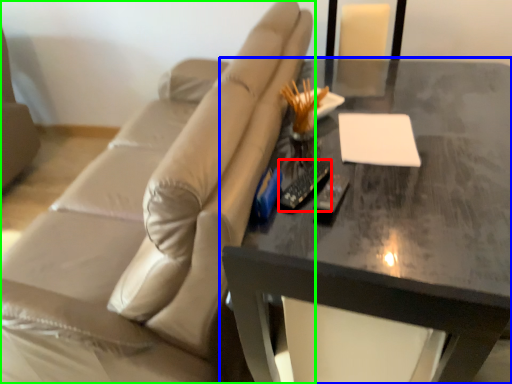
Question: Estimate the real-world distances between objects in this image. Which object is closer to remote (highlighted by a red box), table (highlighted by a blue box) or studio couch (highlighted by a green box)?

Choices:
 (A) table
 (B) studio couch

Answer: (A)